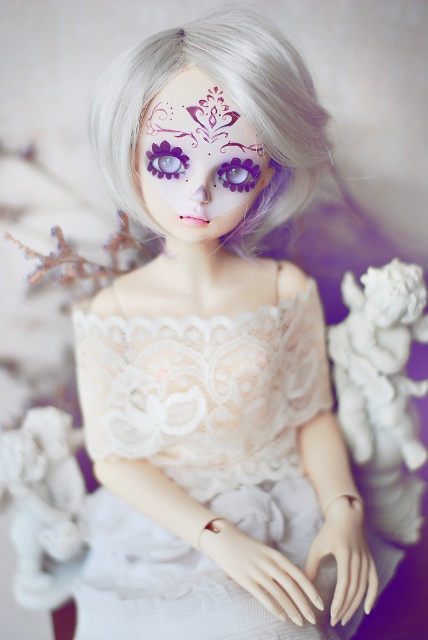
Can you confirm if lace fabric dress at center is thinner than purple matte eye at upper left?

No, lace fabric dress at center is not thinner than purple matte eye at upper left.

Is lace fabric dress at center closer to camera compared to purple matte eye at upper left?

Yes, it is.

The width and height of the screenshot is (428, 640). What do you see at coordinates (214, 406) in the screenshot?
I see `lace fabric dress at center` at bounding box center [214, 406].

Locate an element on the screen. The width and height of the screenshot is (428, 640). lace fabric dress at center is located at coordinates (214, 406).

Who is positioned more to the left, matte purple face at center or purple glossy eye at center?

matte purple face at center is more to the left.

Is point (199, 150) in front of point (234, 160)?

Yes, it is in front of point (234, 160).

The width and height of the screenshot is (428, 640). What are the coordinates of `matte purple face at center` in the screenshot? It's located at (198, 160).

Can you confirm if lace fabric dress at center is positioned below purple glossy eye at center?

Correct, lace fabric dress at center is located below purple glossy eye at center.

Identify the location of lace fabric dress at center. Image resolution: width=428 pixels, height=640 pixels. (214, 406).

Identify the location of lace fabric dress at center. (214, 406).

Identify the location of lace fabric dress at center. (214, 406).